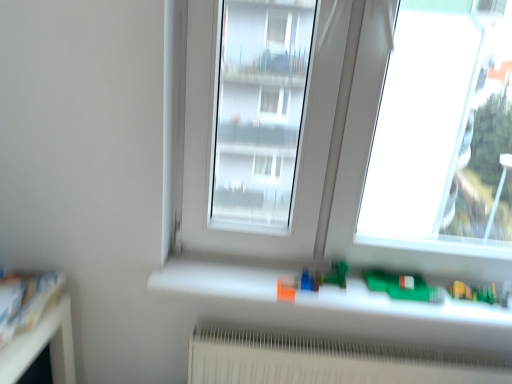
The image size is (512, 384). What do you see at coordinates (312, 296) in the screenshot?
I see `white plastic window sill at lower center` at bounding box center [312, 296].

The width and height of the screenshot is (512, 384). What are the coordinates of `white plastic window sill at lower center` in the screenshot? It's located at (312, 296).

This screenshot has height=384, width=512. Find the location of `white plastic window sill at lower center`. white plastic window sill at lower center is located at coordinates (312, 296).